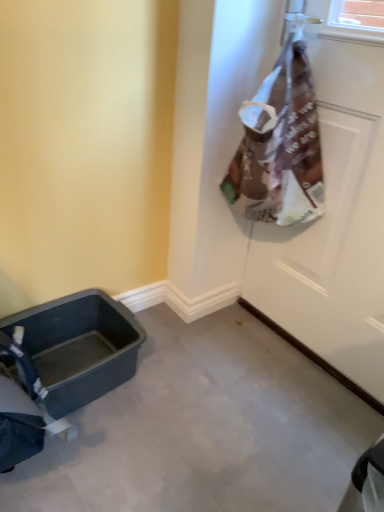
What is the approximate width of white matte door at upper right?

The width of white matte door at upper right is 2.64 inches.

What are the coordinates of `white matte door at upper right` in the screenshot? It's located at (335, 217).

What do you see at coordinates (335, 217) in the screenshot?
I see `white matte door at upper right` at bounding box center [335, 217].

This screenshot has height=512, width=384. What do you see at coordinates (79, 347) in the screenshot?
I see `matte plastic baby carriage at lower left` at bounding box center [79, 347].

This screenshot has width=384, height=512. Find the location of `matte plastic baby carriage at lower left`. matte plastic baby carriage at lower left is located at coordinates (79, 347).

You are a GUI agent. You are given a task and a screenshot of the screen. Output one action in this format:
    pyautogui.click(x=<x>, y=<y>)
    Task: Click on the white matte door at upper right
    
    Given the screenshot: What is the action you would take?
    pyautogui.click(x=335, y=217)

Which object is positioned more to the right, matte plastic baby carriage at lower left or white matte door at upper right?

Positioned to the right is white matte door at upper right.

Which is behind, matte plastic baby carriage at lower left or white matte door at upper right?

Positioned behind is matte plastic baby carriage at lower left.

Is point (95, 384) more distant than point (319, 287)?

No, it is in front of (319, 287).

From the image's perspective, is matte plastic baby carriage at lower left beneath white matte door at upper right?

Yes, from the image's perspective, matte plastic baby carriage at lower left is beneath white matte door at upper right.

From a real-world perspective, relative to white matte door at upper right, is matte plastic baby carriage at lower left vertically above or below?

In terms of real-world spatial position, matte plastic baby carriage at lower left is below white matte door at upper right.

Is matte plastic baby carriage at lower left thinner than white matte door at upper right?

No, matte plastic baby carriage at lower left is not thinner than white matte door at upper right.

Does matte plastic baby carriage at lower left have a lesser height compared to white matte door at upper right?

Correct, matte plastic baby carriage at lower left is not as tall as white matte door at upper right.

Considering the sizes of matte plastic baby carriage at lower left and white matte door at upper right in the image, is matte plastic baby carriage at lower left bigger or smaller than white matte door at upper right?

Considering their sizes, matte plastic baby carriage at lower left takes up less space than white matte door at upper right.

Is matte plastic baby carriage at lower left located outside white matte door at upper right?

matte plastic baby carriage at lower left is positioned outside white matte door at upper right.

Is matte plastic baby carriage at lower left beside white matte door at upper right?

matte plastic baby carriage at lower left is not next to white matte door at upper right, and they're not touching.

Is matte plastic baby carriage at lower left turned away from white matte door at upper right?

matte plastic baby carriage at lower left is not turned away from white matte door at upper right.

How different are the orientations of matte plastic baby carriage at lower left and white matte door at upper right in degrees?

The facing directions of matte plastic baby carriage at lower left and white matte door at upper right are 91.5 degrees apart.

Find the location of a particular element. door located on the right of matte plastic baby carriage at lower left is located at coordinates (335, 217).

In the image, is white matte door at upper right on the left side or the right side of matte plastic baby carriage at lower left?

Clearly, white matte door at upper right is on the right of matte plastic baby carriage at lower left in the image.

Does white matte door at upper right lie behind matte plastic baby carriage at lower left?

No, it is not.

Is point (328, 125) closer to viewer compared to point (94, 380)?

Yes, it is.

From the image's perspective, is white matte door at upper right below matte plastic baby carriage at lower left?

No, from the image's perspective, white matte door at upper right is not below matte plastic baby carriage at lower left.

From a real-world perspective, between white matte door at upper right and matte plastic baby carriage at lower left, who is vertically higher?

In real-world perspective, white matte door at upper right is above.

Which object is wider, white matte door at upper right or matte plastic baby carriage at lower left?

matte plastic baby carriage at lower left.

Can you confirm if white matte door at upper right is shorter than matte plastic baby carriage at lower left?

Incorrect, the height of white matte door at upper right does not fall short of that of matte plastic baby carriage at lower left.

Considering the relative sizes of white matte door at upper right and matte plastic baby carriage at lower left in the image provided, is white matte door at upper right smaller than matte plastic baby carriage at lower left?

No.

Is white matte door at upper right outside of matte plastic baby carriage at lower left?

Yes, white matte door at upper right is located beyond the bounds of matte plastic baby carriage at lower left.

Are white matte door at upper right and matte plastic baby carriage at lower left far apart?

No, white matte door at upper right is not far from matte plastic baby carriage at lower left.

Does white matte door at upper right turn towards matte plastic baby carriage at lower left?

Yes, white matte door at upper right is aimed at matte plastic baby carriage at lower left.

What's the angular difference between white matte door at upper right and matte plastic baby carriage at lower left's facing directions?

white matte door at upper right and matte plastic baby carriage at lower left are facing 91.5 degrees away from each other.

At what (x,y) coordinates should I click in order to perform the action: click on baby carriage behind the white matte door at upper right. Please return your answer as a coordinate pair (x, y). The image size is (384, 512). Looking at the image, I should click on (79, 347).

This screenshot has width=384, height=512. What are the coordinates of `baby carriage below the white matte door at upper right (from a real-world perspective)` in the screenshot? It's located at (79, 347).

I want to click on door lying above the matte plastic baby carriage at lower left (from the image's perspective), so click(x=335, y=217).